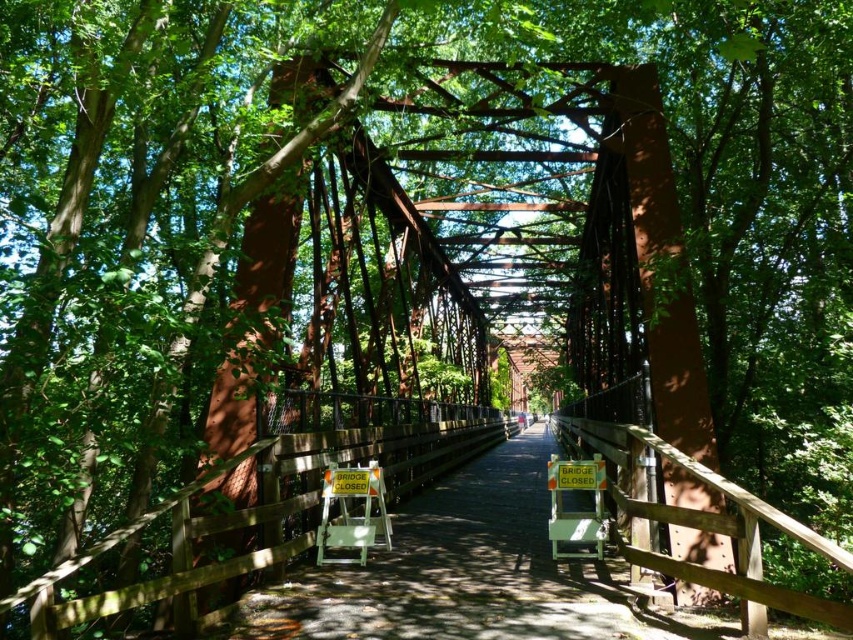
You are a delivery person with a large box that is 1.2 meters wide. You need to carry it across the pedestrian bridge. The bridge has an orange plastic chair at center and an orange plastic sign at center. Can you pass through the narrowest point between these two objects?

The orange plastic chair at center might be wider than orange plastic sign at center, so the narrowest point between them is likely the width of the orange plastic sign at center. Since the box is 1.2 meters wide, you need to check if the sign is wider than 1.2 meters. If the sign is narrower, the box won

You are standing on the pedestrian bridge and want to place an object exactly at the center of the bridge. According to the image, is the orange plastic chair at center located at the center of the bridge?

The orange plastic chair at center is located at point [351,515], which is not the exact center of the bridge. The center would be at point [426,320] in a normalized coordinate system.

You are standing on the pedestrian bridge and want to determine the relative positions of two points on the bridge. The first point is at coordinates point (332, 481) and the second is at point (561, 492). Which point is nearer to you?

Point (332, 481) is closer to the viewer than point (561, 492).